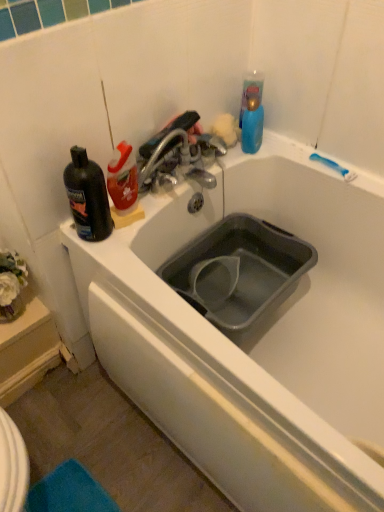
Question: From a real-world perspective, is black plastic bottle at upper left below gray plastic sink at center?

Choices:
 (A) yes
 (B) no

Answer: (B)

Question: Is black plastic bottle at upper left oriented away from gray plastic sink at center?

Choices:
 (A) yes
 (B) no

Answer: (B)

Question: From the image's perspective, is black plastic bottle at upper left under gray plastic sink at center?

Choices:
 (A) no
 (B) yes

Answer: (A)

Question: From a real-world perspective, is black plastic bottle at upper left positioned over gray plastic sink at center based on gravity?

Choices:
 (A) no
 (B) yes

Answer: (B)

Question: Is black plastic bottle at upper left next to gray plastic sink at center?

Choices:
 (A) yes
 (B) no

Answer: (B)

Question: Considering the positions of white matte bathtub at center and gray plastic sink at center in the image, is white matte bathtub at center wider or thinner than gray plastic sink at center?

Choices:
 (A) wide
 (B) thin

Answer: (A)

Question: Would you say white matte bathtub at center is to the left or to the right of gray plastic sink at center in the picture?

Choices:
 (A) left
 (B) right

Answer: (A)

Question: In the image, is white matte bathtub at center positioned in front of or behind gray plastic sink at center?

Choices:
 (A) front
 (B) behind

Answer: (A)

Question: Is point (215, 394) closer or farther from the camera than point (221, 245)?

Choices:
 (A) closer
 (B) farther

Answer: (A)

Question: Is black plastic bottle at upper left in front of or behind white matte bathtub at center in the image?

Choices:
 (A) front
 (B) behind

Answer: (B)

Question: From a real-world perspective, is black plastic bottle at upper left physically located above or below white matte bathtub at center?

Choices:
 (A) below
 (B) above

Answer: (B)

Question: In the image, is black plastic bottle at upper left on the left side or the right side of white matte bathtub at center?

Choices:
 (A) right
 (B) left

Answer: (B)

Question: Considering the positions of black plastic bottle at upper left and white matte bathtub at center in the image, is black plastic bottle at upper left taller or shorter than white matte bathtub at center?

Choices:
 (A) short
 (B) tall

Answer: (B)

Question: Is metallic silver faucet at upper center taller or shorter than black plastic bottle at upper left?

Choices:
 (A) short
 (B) tall

Answer: (A)

Question: Do you think metallic silver faucet at upper center is within black plastic bottle at upper left, or outside of it?

Choices:
 (A) outside
 (B) inside

Answer: (A)